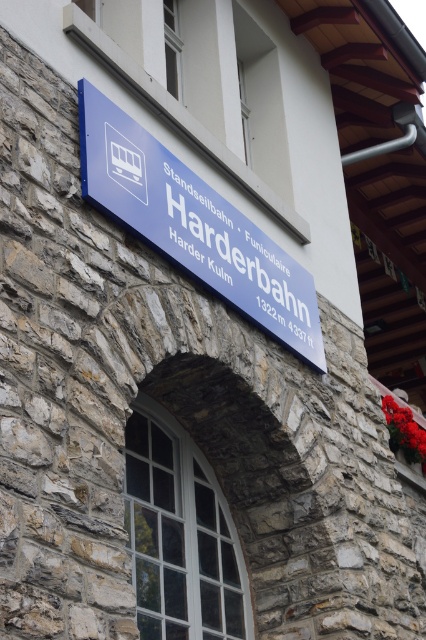
You are a GUI agent. You are given a task and a screenshot of the screen. Output one action in this format:
    pyautogui.click(x=<x>, y=<y>)
    Task: Click on the blue plastic sign at upper center
    
    Given the screenshot: What is the action you would take?
    pyautogui.click(x=193, y=225)

Is point (218, 218) positioned before point (198, 248)?

No.

Is point (146, 161) in front of point (199, 244)?

Yes, point (146, 161) is closer to viewer.

At what (x,y) coordinates should I click in order to perform the action: click on blue plastic sign at upper center. Please return your answer as a coordinate pair (x, y). This screenshot has height=640, width=426. Looking at the image, I should click on (193, 225).